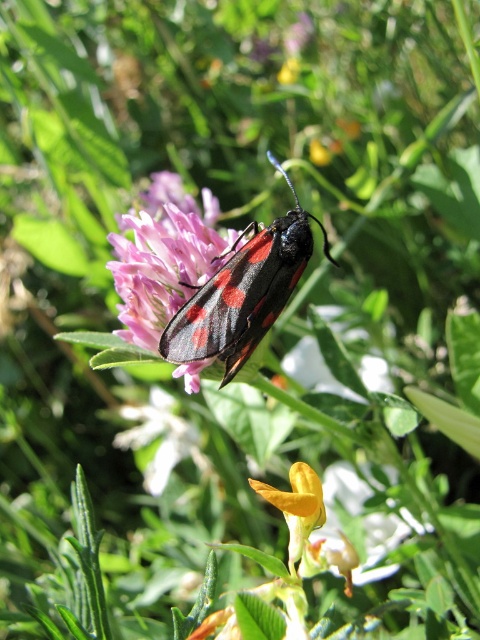
Can you confirm if matte black moth at center is positioned to the right of matte pink flower at center?

No, matte black moth at center is not to the right of matte pink flower at center.

Who is positioned more to the left, matte black moth at center or matte pink flower at center?

matte black moth at center is more to the left.

Locate an element on the screen. matte black moth at center is located at coordinates tap(163, 257).

Between matte black moth at center and shiny black beetle at center, which one has less height?

Standing shorter between the two is matte black moth at center.

Is matte black moth at center to the left of shiny black beetle at center from the viewer's perspective?

Correct, you'll find matte black moth at center to the left of shiny black beetle at center.

Is point (212, 253) farther from viewer compared to point (311, 244)?

Yes, it is.

This screenshot has height=640, width=480. Identify the location of matte black moth at center. (163, 257).

Which is behind, point (395, 547) or point (346, 365)?

Point (395, 547)

Is smooth yellow flower at center smaller than matte pink flower at center?

Yes.

Between point (389, 525) and point (359, 368), which one is positioned behind?

The point (359, 368) is more distant.

Locate an element on the screen. smooth yellow flower at center is located at coordinates [x=361, y=522].